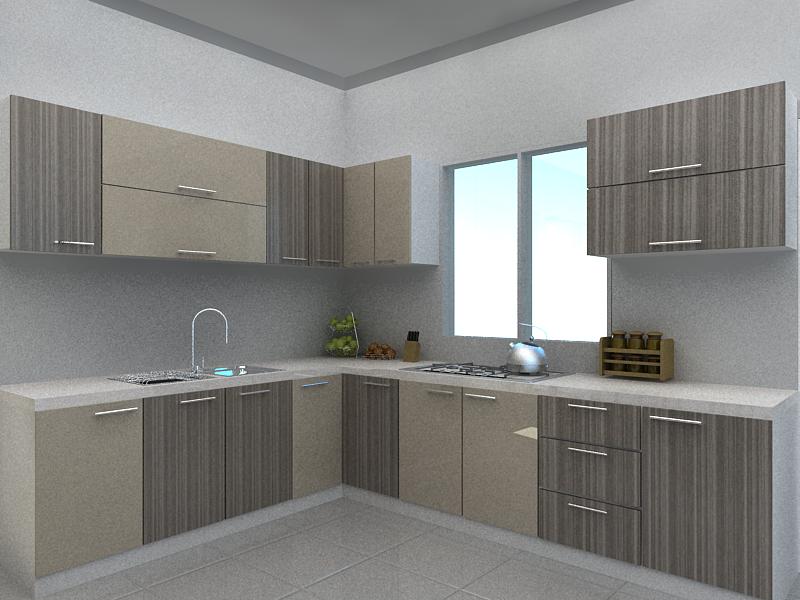
Find the location of `drawer`. drawer is located at coordinates (674, 420).